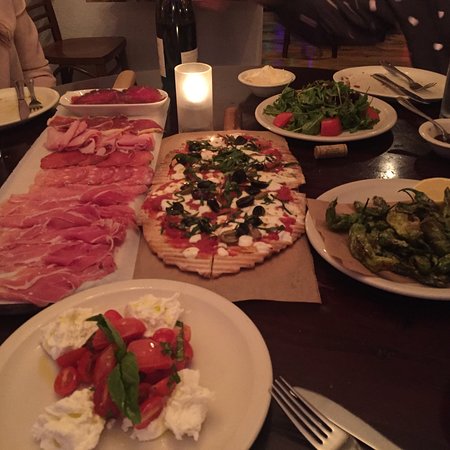
Identify the location of floor. (356, 54).